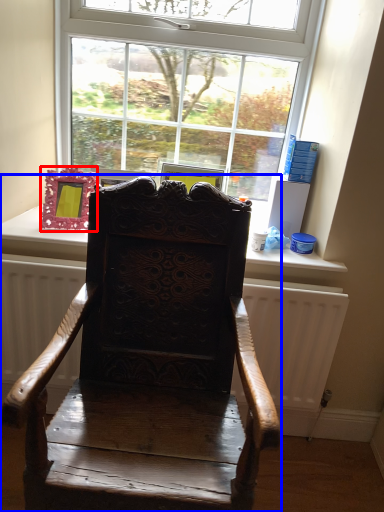
Question: Which of the following is the closest to the observer, picture frame (highlighted by a red box) or chair (highlighted by a blue box)?

Choices:
 (A) picture frame
 (B) chair

Answer: (B)